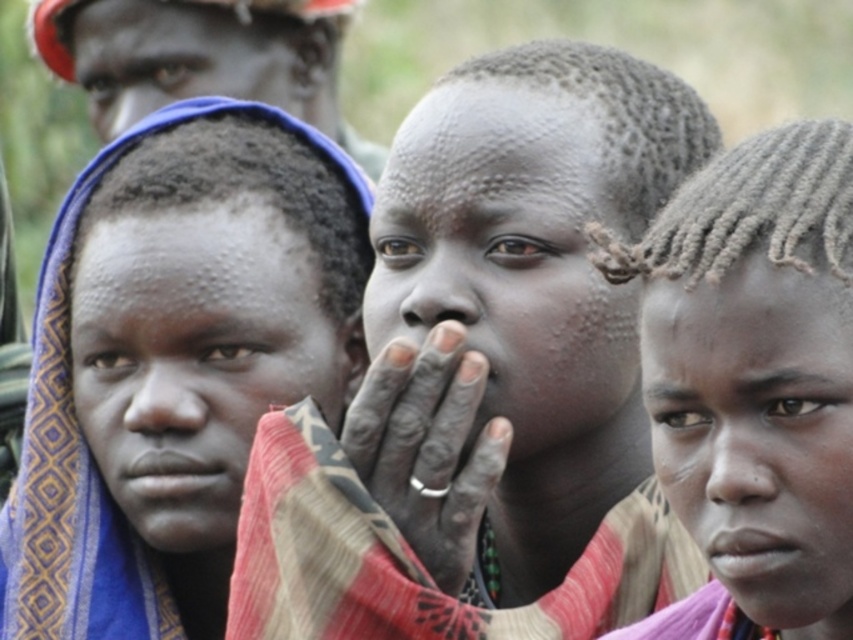
Question: Which point is farther to the camera?

Choices:
 (A) matte red helmet at upper left
 (B) dark skin hair at center
 (C) dark skin ring at center
 (D) blue woven cloth at left

Answer: (A)

Question: Is matte skin child at center behind matte red helmet at upper left?

Choices:
 (A) no
 (B) yes

Answer: (A)

Question: Does blue woven cloth at left appear over matte red helmet at upper left?

Choices:
 (A) no
 (B) yes

Answer: (A)

Question: Which point is farther to the camera?

Choices:
 (A) dark skin hair at center
 (B) matte skin child at center
 (C) dark skin ring at center
 (D) matte red helmet at upper left

Answer: (D)

Question: Does matte skin child at center have a lesser width compared to blue woven cloth at left?

Choices:
 (A) yes
 (B) no

Answer: (A)

Question: Which of the following is the closest to the observer?

Choices:
 (A) (370, 456)
 (B) (305, 616)
 (C) (134, 600)

Answer: (A)